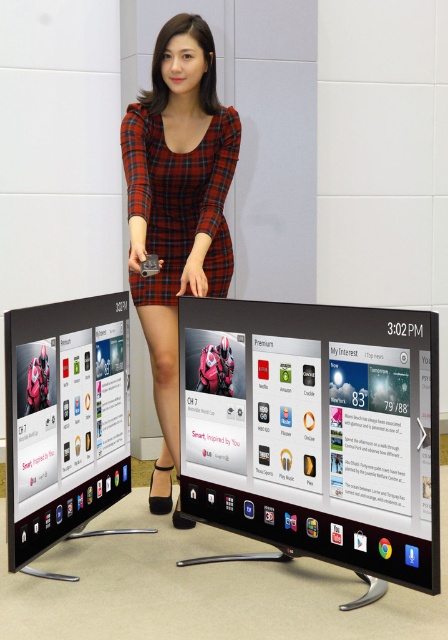
You are a photographer setting up for a product shoot. You need to ensure that the red plaid dress at center is visible above the matte black screen at center in the final image. Based on the scene description, can you confirm if this is possible?

The red plaid dress at center has a greater height compared to the matte black screen at center, so yes, the dress will be visible above the screen in the final image.

You are a photographer trying to focus on the two points in the image. Which point is closer to your camera lens, point (59, 346) or point (176, 228)?

Point (59, 346) is closer to the camera than point (176, 228).

You are a photographer at the event and want to capture the red plaid dress at center and the matte black screen at center in a single frame. Which object should you focus on first to ensure both are in focus?

The red plaid dress at center is larger in size than the matte black screen at center, so you should focus on the red plaid dress at center first to ensure both are in focus.